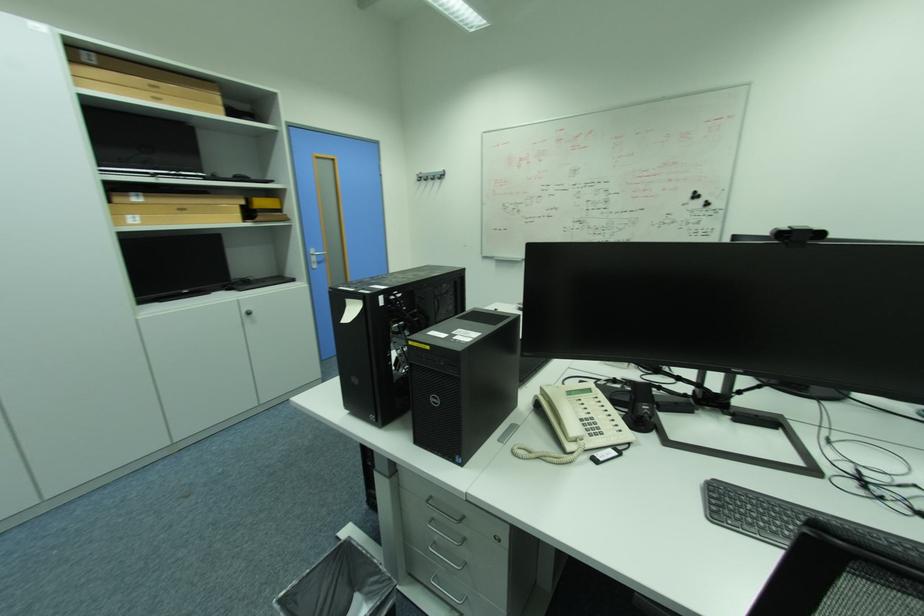
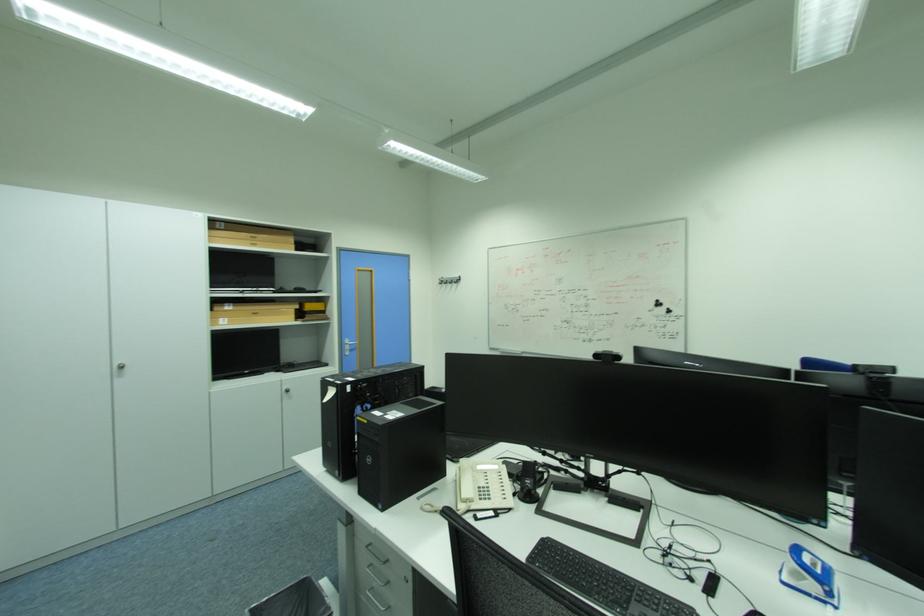
Locate, in the second image, the point that corresponds to point 320,252 in the first image.

(355, 342)